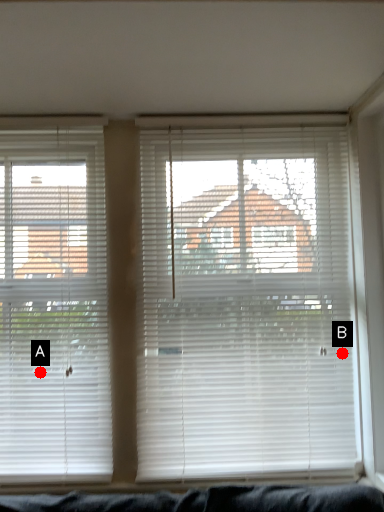
Question: Two points are circled on the image, labeled by A and B beside each circle. Which point is farther to the camera?

Choices:
 (A) A is further
 (B) B is further

Answer: (B)